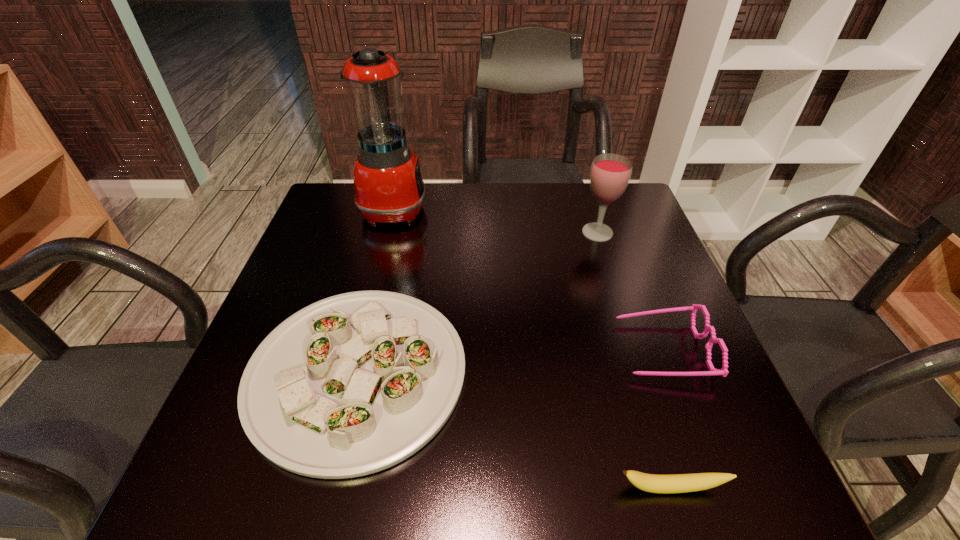
You are a GUI agent. You are given a task and a screenshot of the screen. Output one action in this format:
    pyautogui.click(x=<x>, y=<y>)
    Task: Click on the free space at the far right corner of the desktop
    
    Given the screenshot: What is the action you would take?
    pyautogui.click(x=627, y=225)

Locate an element on the screen. The height and width of the screenshot is (540, 960). vacant space that's between the tallest object and the spectacles is located at coordinates (528, 279).

This screenshot has height=540, width=960. Find the location of `empty space between the shortest object and the spectacles`. empty space between the shortest object and the spectacles is located at coordinates (666, 419).

What are the coordinates of `vacant space in between the shortest object and the platter` in the screenshot? It's located at (514, 430).

The width and height of the screenshot is (960, 540). I want to click on empty location between the spectacles and the platter, so click(510, 361).

This screenshot has width=960, height=540. Find the location of `free space between the spectacles and the banana`. free space between the spectacles and the banana is located at coordinates (666, 419).

The width and height of the screenshot is (960, 540). Identify the location of free point between the shortest object and the spectacles. (666, 419).

At what (x,y) coordinates should I click in order to perform the action: click on empty location between the tallest object and the fourth shortest object. Please return your answer as a coordinate pair (x, y). The width and height of the screenshot is (960, 540). Looking at the image, I should click on (495, 220).

Where is `free space that is in between the platter and the shortest object`? free space that is in between the platter and the shortest object is located at coordinates (514, 430).

You are a GUI agent. You are given a task and a screenshot of the screen. Output one action in this format:
    pyautogui.click(x=<x>, y=<y>)
    Task: Click on the free space between the tallest object and the wineglass
    Image resolution: width=960 pixels, height=540 pixels.
    Given the screenshot: What is the action you would take?
    pyautogui.click(x=495, y=220)